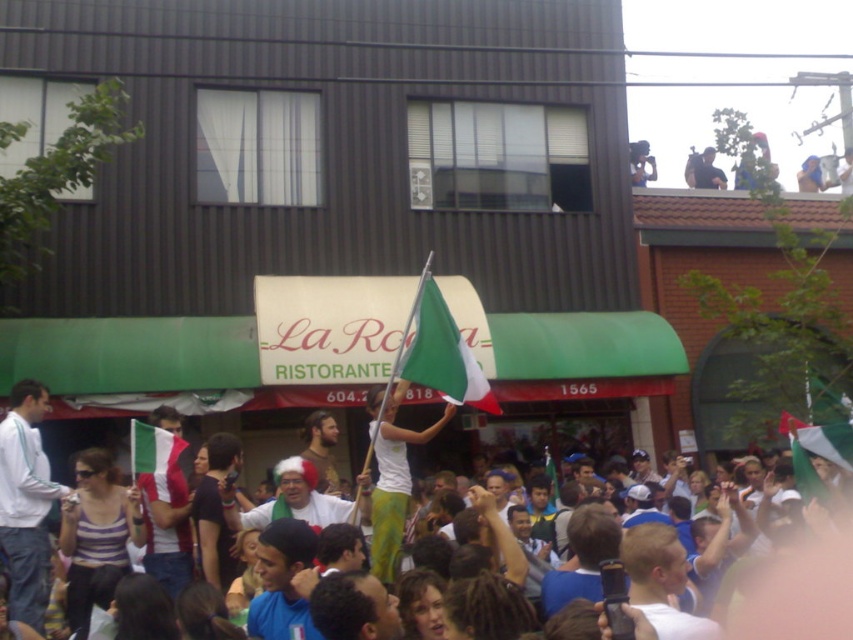
Is white matte flag at center in front of metallic silver camera at upper right?

Yes, white matte flag at center is in front of metallic silver camera at upper right.

I want to click on white matte flag at center, so click(392, 476).

The height and width of the screenshot is (640, 853). In order to click on white matte flag at center in this screenshot , I will do click(392, 476).

Does white cotton shirt at left appear over green-white-red fabric flag at center?

No, white cotton shirt at left is not above green-white-red fabric flag at center.

Does point (10, 605) come farther from viewer compared to point (784, 426)?

No, (10, 605) is in front of (784, 426).

Where is `white cotton shirt at left`? Image resolution: width=853 pixels, height=640 pixels. white cotton shirt at left is located at coordinates [25, 502].

Can you confirm if green fabric flag at center is positioned to the right of dark blue shirt at upper center?

In fact, green fabric flag at center is to the left of dark blue shirt at upper center.

From the picture: Can you confirm if green fabric flag at center is positioned to the left of dark blue shirt at upper center?

Yes, green fabric flag at center is to the left of dark blue shirt at upper center.

Does point (422, 342) come closer to viewer compared to point (688, 164)?

Yes, it is.

At what (x,y) coordinates should I click in order to perform the action: click on green fabric flag at center. Please return your answer as a coordinate pair (x, y). The height and width of the screenshot is (640, 853). Looking at the image, I should click on [440, 353].